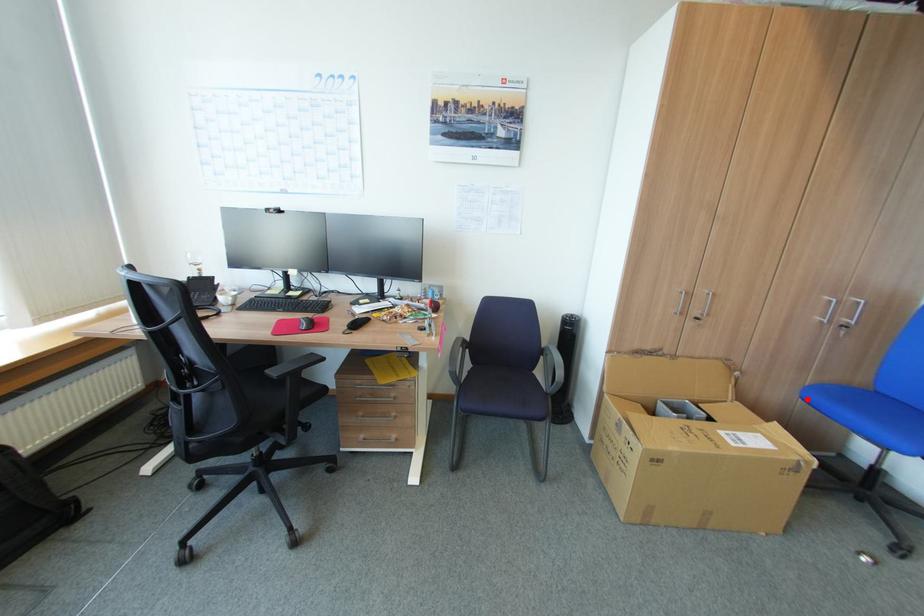
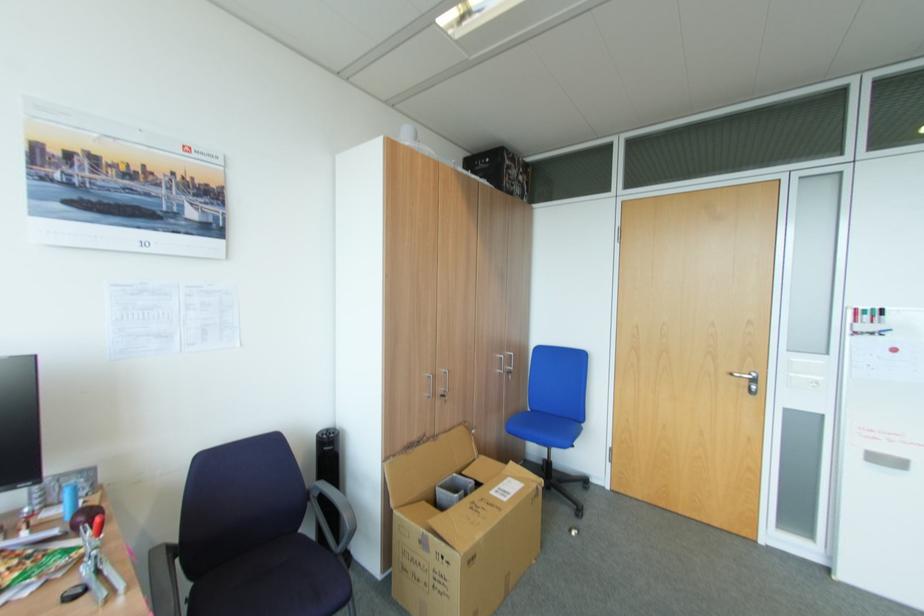
Question: A red point is marked in image1. In image2, is the corresponding 3D point closer to the camera or farther? Reply with the corresponding letter.

Choices:
 (A) The corresponding 3D point is closer.
 (B) The corresponding 3D point is farther.

Answer: (B)